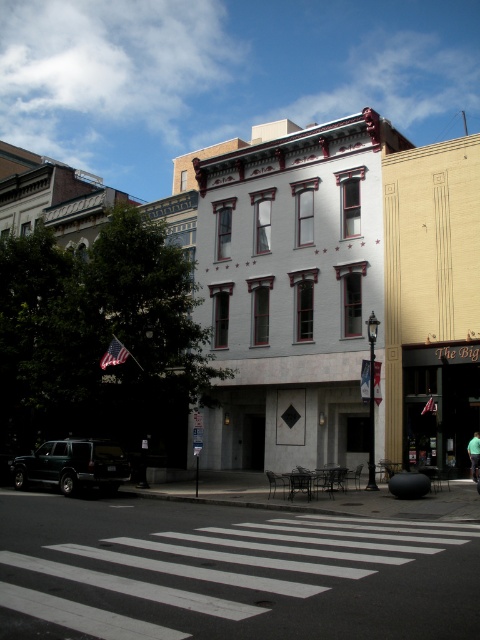
Question: Which point appears farthest from the camera in this image?

Choices:
 (A) (x=99, y=461)
 (B) (x=75, y=568)

Answer: (A)

Question: Can you confirm if white painted crosswalk at lower center is positioned above dark green matte suv at lower left?

Choices:
 (A) yes
 (B) no

Answer: (A)

Question: Is white painted crosswalk at lower center wider than dark green matte suv at lower left?

Choices:
 (A) no
 (B) yes

Answer: (B)

Question: Which object appears farthest from the camera in this image?

Choices:
 (A) dark green matte suv at lower left
 (B) white painted crosswalk at lower center

Answer: (A)

Question: Which point appears farthest from the camera in this image?

Choices:
 (A) (70, 470)
 (B) (164, 515)

Answer: (A)

Question: Can you confirm if white painted crosswalk at lower center is positioned above dark green matte suv at lower left?

Choices:
 (A) no
 (B) yes

Answer: (B)